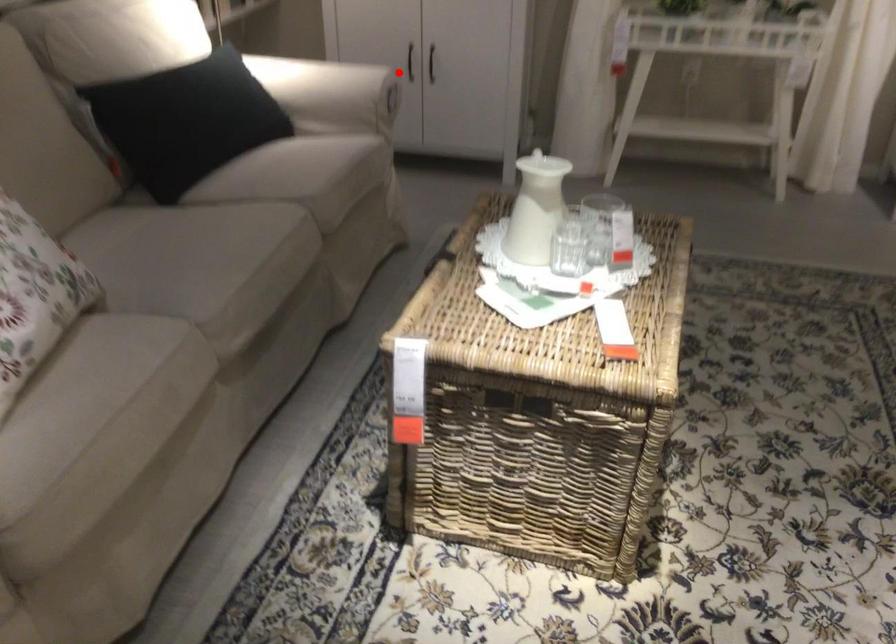
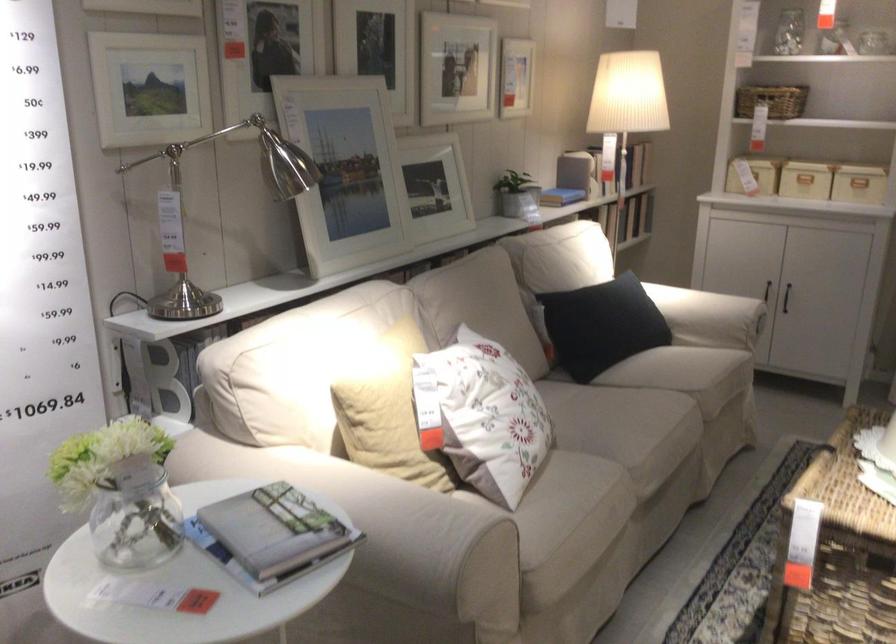
The point at the highlighted location is marked in the first image. Where is the corresponding point in the second image?

(765, 290)